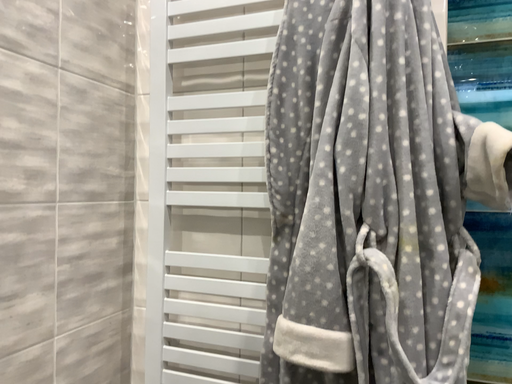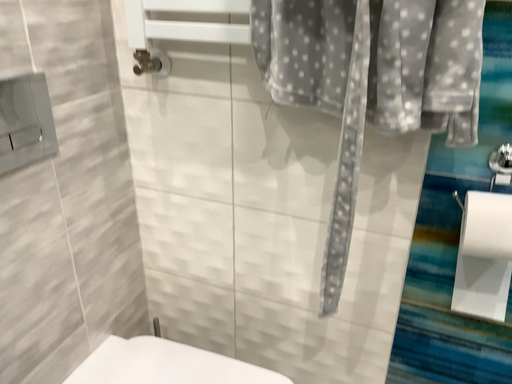
Question: How did the camera likely rotate when shooting the video?

Choices:
 (A) rotated upward
 (B) rotated downward

Answer: (B)